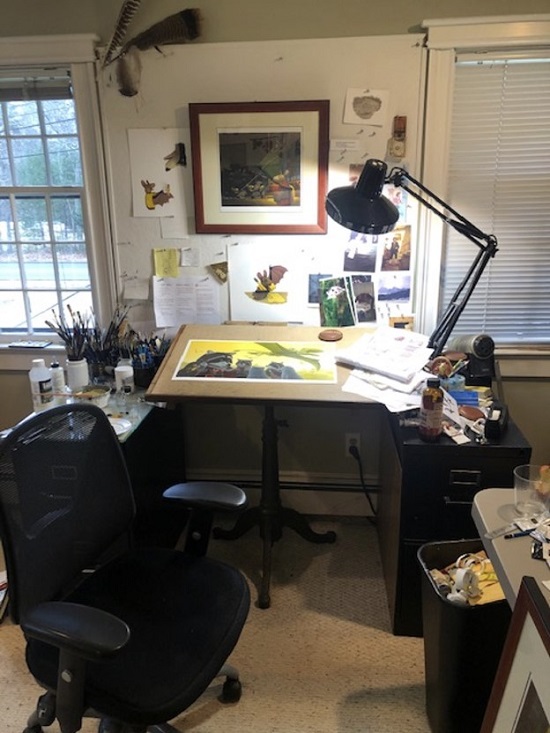
Locate an element on the screen. The width and height of the screenshot is (550, 733). white window frame, wood is located at coordinates (66, 37), (463, 37).